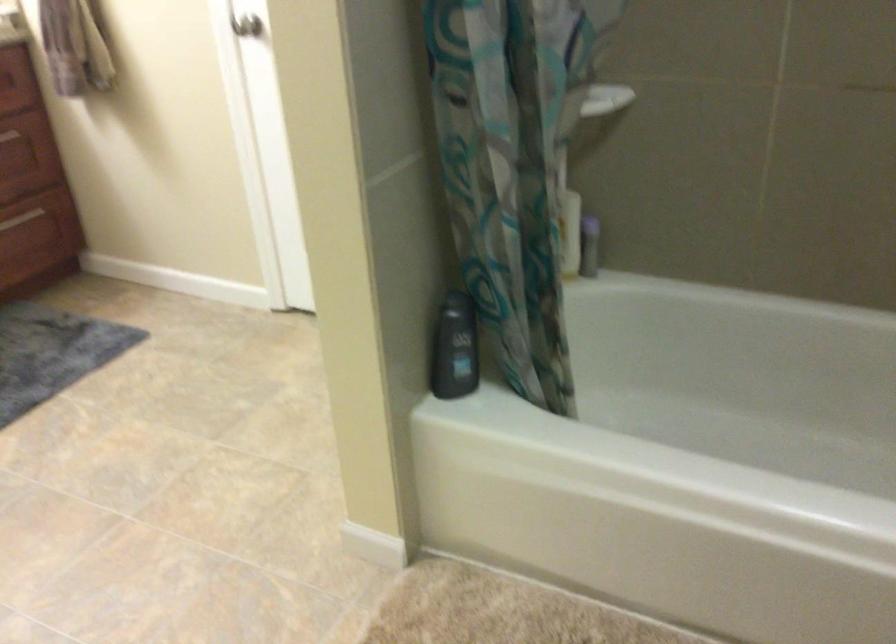
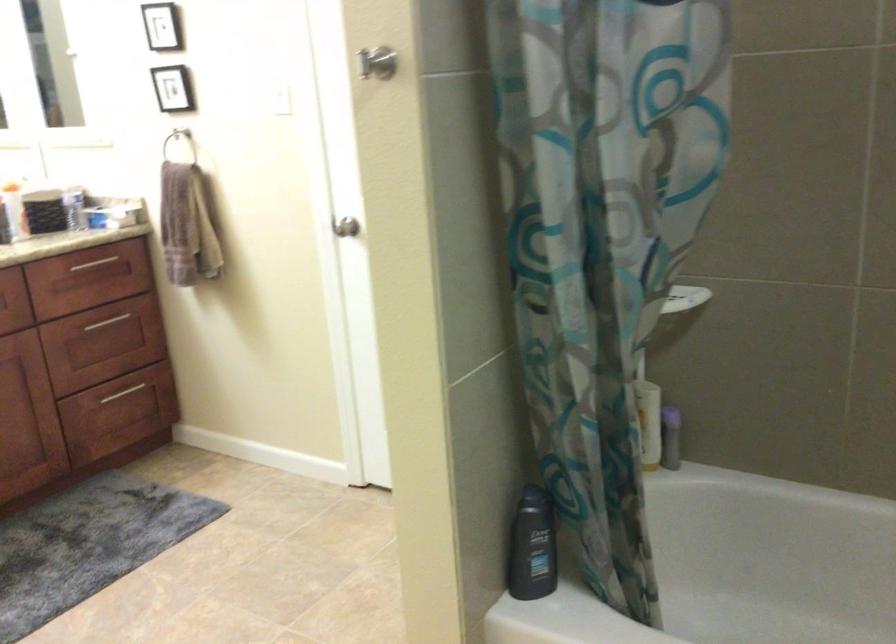
Find the pixel in the second image that matches (453,352) in the first image.

(531, 547)